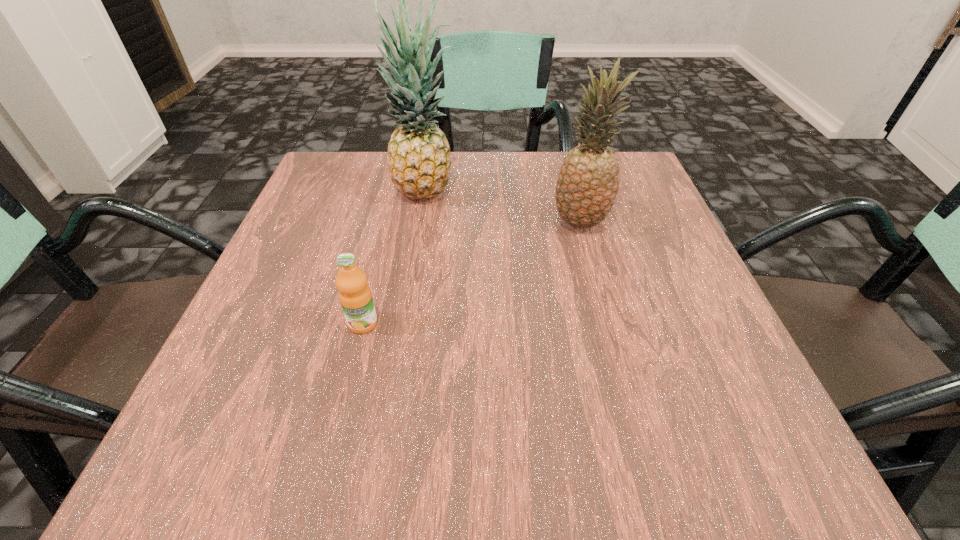
Locate an element on the screen. The height and width of the screenshot is (540, 960). the tallest object is located at coordinates click(x=419, y=160).

At what (x,y) coordinates should I click in order to perform the action: click on the left pineapple. Please return your answer as a coordinate pair (x, y). The width and height of the screenshot is (960, 540). Looking at the image, I should click on (419, 160).

You are a GUI agent. You are given a task and a screenshot of the screen. Output one action in this format:
    pyautogui.click(x=<x>, y=<y>)
    Task: Click on the shorter pineapple
    The height and width of the screenshot is (540, 960).
    Given the screenshot: What is the action you would take?
    pyautogui.click(x=588, y=182)

This screenshot has width=960, height=540. What are the coordinates of `the rightmost object` in the screenshot? It's located at (588, 182).

Where is `the nearest object`? the nearest object is located at coordinates (355, 296).

Locate an element on the screen. This screenshot has width=960, height=540. the shortest object is located at coordinates (355, 296).

The width and height of the screenshot is (960, 540). I want to click on blank space located on the front of the tallest object, so click(x=420, y=234).

Locate an element on the screen. The width and height of the screenshot is (960, 540). free location located 0.160m on the left of the rightmost object is located at coordinates (471, 222).

This screenshot has height=540, width=960. I want to click on vacant space located 0.150m on the label of the nearest object, so click(x=338, y=425).

You are a GUI agent. You are given a task and a screenshot of the screen. Output one action in this format:
    pyautogui.click(x=<x>, y=<y>)
    Task: Click on the object located at the right edge
    The width and height of the screenshot is (960, 540).
    Given the screenshot: What is the action you would take?
    pyautogui.click(x=588, y=182)